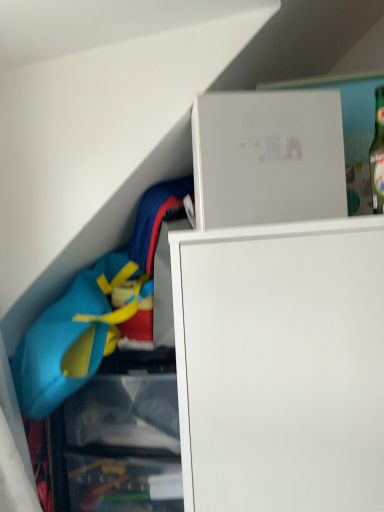
Question: From a real-world perspective, is white matte box at upper center physically below matte blue life vest at left?

Choices:
 (A) no
 (B) yes

Answer: (A)

Question: Can you confirm if white matte box at upper center is wider than matte blue life vest at left?

Choices:
 (A) no
 (B) yes

Answer: (A)

Question: From the image's perspective, is white matte box at upper center under matte blue life vest at left?

Choices:
 (A) yes
 (B) no

Answer: (B)

Question: Can you confirm if white matte box at upper center is taller than matte blue life vest at left?

Choices:
 (A) no
 (B) yes

Answer: (A)

Question: Is white matte box at upper center oriented towards matte blue life vest at left?

Choices:
 (A) yes
 (B) no

Answer: (B)

Question: Does white matte box at upper center appear on the left side of matte blue life vest at left?

Choices:
 (A) yes
 (B) no

Answer: (B)

Question: Could you tell me if matte blue life vest at left is facing white matte box at upper center?

Choices:
 (A) no
 (B) yes

Answer: (A)

Question: From a real-world perspective, is matte blue life vest at left under white matte box at upper center?

Choices:
 (A) no
 (B) yes

Answer: (B)

Question: From the image's perspective, is matte blue life vest at left over white matte box at upper center?

Choices:
 (A) yes
 (B) no

Answer: (B)

Question: Considering the relative sizes of matte blue life vest at left and white matte box at upper center in the image provided, is matte blue life vest at left thinner than white matte box at upper center?

Choices:
 (A) no
 (B) yes

Answer: (A)

Question: Is matte blue life vest at left turned away from white matte box at upper center?

Choices:
 (A) no
 (B) yes

Answer: (A)

Question: Are matte blue life vest at left and white matte box at upper center making contact?

Choices:
 (A) yes
 (B) no

Answer: (B)

Question: Is white matte box at upper center to the left or to the right of matte blue life vest at left in the image?

Choices:
 (A) left
 (B) right

Answer: (B)